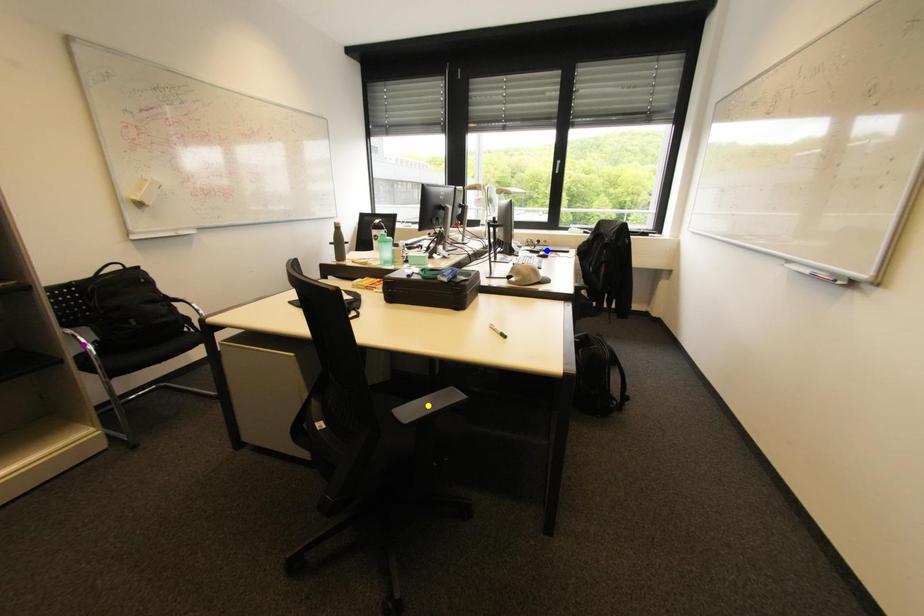
Order these from nearest to farthest:
yellow point
purple point
blue point

yellow point, purple point, blue point